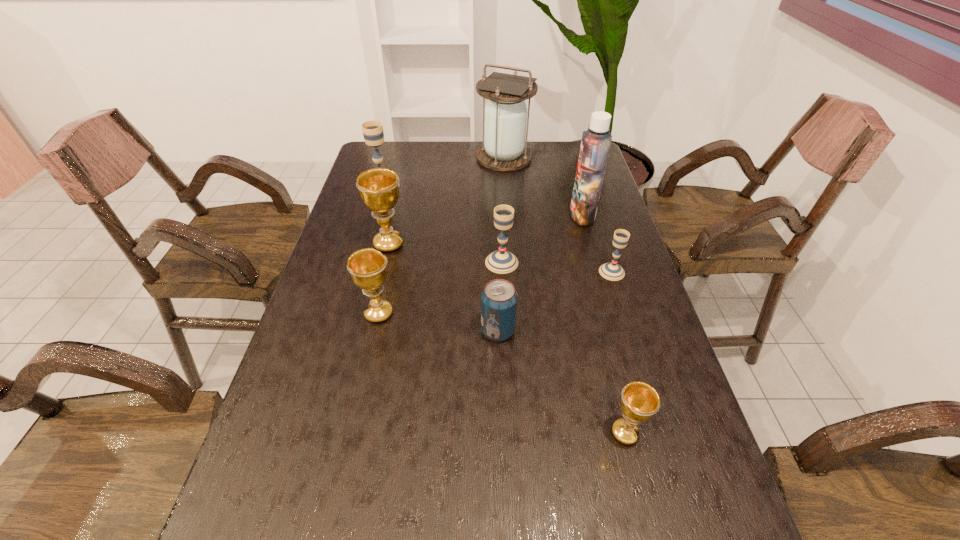
Locate an element on the screen. vacant space at the far left corner of the desktop is located at coordinates (390, 160).

At what (x,y) coordinates should I click in order to perform the action: click on vacant space at the far right corner of the desktop. Please return your answer as a coordinate pair (x, y). Looking at the image, I should click on (576, 149).

At what (x,y) coordinates should I click in order to perform the action: click on vacant area between the second biggest gray chalice and the leftmost gray chalice. Please return your answer as a coordinate pair (x, y). Looking at the image, I should click on (443, 224).

Locate an element on the screen. This screenshot has height=540, width=960. free space that is in between the farthest chalice and the fourth chalice from left to right is located at coordinates (443, 224).

Locate an element on the screen. free space between the shampoo and the farthest gold chalice is located at coordinates (486, 230).

Locate an element on the screen. Image resolution: width=960 pixels, height=540 pixels. free space that is in between the biggest gold chalice and the pop soda is located at coordinates (444, 287).

This screenshot has width=960, height=540. Find the location of `the eighth closest object to the pop soda`. the eighth closest object to the pop soda is located at coordinates (372, 130).

Select which object is the closest to the biggest gray chalice. Please provide its 2D coordinates. Your answer should be formatted as a tuple, i.e. [(x, y)], where the tuple contains the x and y coordinates of a point satisfying the conditions above.

[(379, 190)]

Identify which chalice is the fifth nearest to the fifth farthest chalice. Please provide its 2D coordinates. Your answer should be formatted as a tuple, i.e. [(x, y)], where the tuple contains the x and y coordinates of a point satisfying the conditions above.

[(612, 271)]

Identify which chalice is the fourth closest to the second farthest object. Please provide its 2D coordinates. Your answer should be formatted as a tuple, i.e. [(x, y)], where the tuple contains the x and y coordinates of a point satisfying the conditions above.

[(612, 271)]